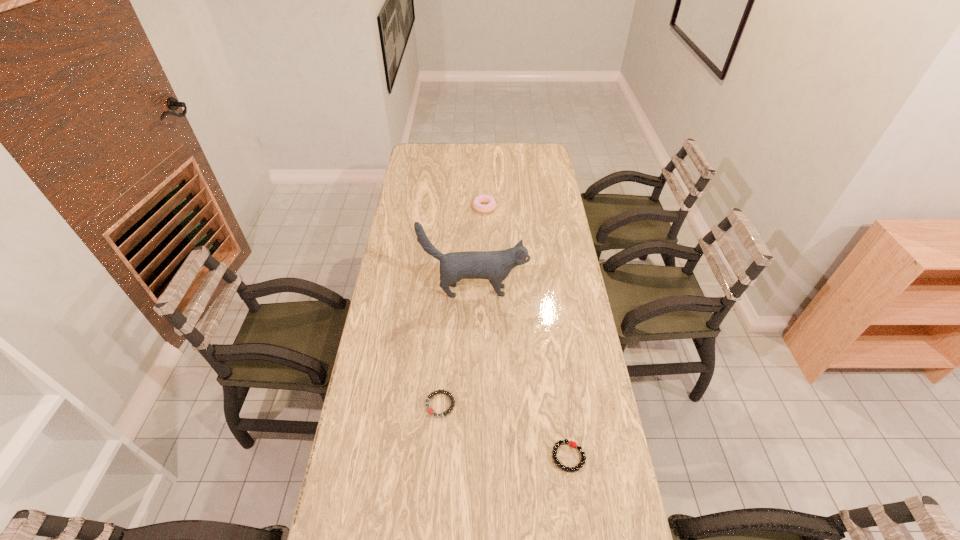
The image size is (960, 540). Identify the location of the tallest object. (495, 266).

This screenshot has height=540, width=960. I want to click on the second farthest object, so click(495, 266).

At what (x,y) coordinates should I click in order to perform the action: click on the farthest object. Please return your answer as a coordinate pair (x, y). Looking at the image, I should click on (476, 204).

Locate an element on the screen. the third shortest object is located at coordinates (476, 204).

Find the location of a particular element. the rightmost object is located at coordinates (572, 444).

Where is `the right bracelet`? the right bracelet is located at coordinates (572, 444).

This screenshot has height=540, width=960. What are the coordinates of `the third farthest object` in the screenshot? It's located at (430, 410).

Locate an element on the screen. The image size is (960, 540). the farther bracelet is located at coordinates (430, 410).

Locate an element on the screen. This screenshot has width=960, height=540. vacant space situated at the face of the third nearest object is located at coordinates (550, 291).

I want to click on free space located 0.150m on the right of the doughnut, so click(x=529, y=207).